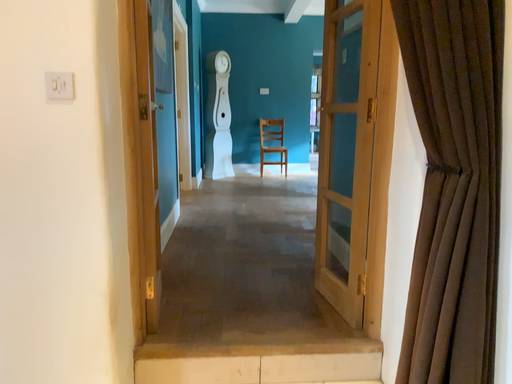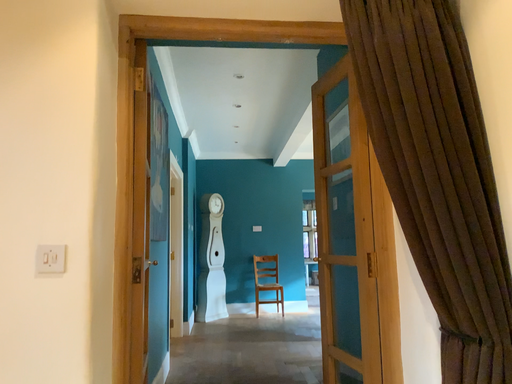
Question: How did the camera likely rotate when shooting the video?

Choices:
 (A) rotated upward
 (B) rotated downward

Answer: (A)